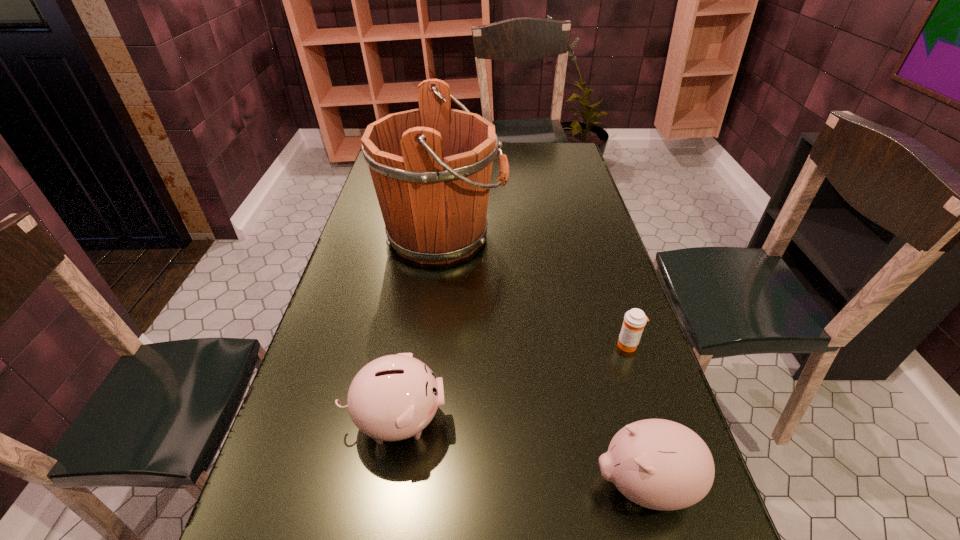
Locate an element on the screen. This screenshot has height=540, width=960. vacant area that lies between the tallest object and the left piggy bank is located at coordinates (420, 328).

At what (x,y) coordinates should I click in order to perform the action: click on free space between the shortest object and the bucket. Please return your answer as a coordinate pair (x, y). The width and height of the screenshot is (960, 540). Looking at the image, I should click on (536, 290).

You are a GUI agent. You are given a task and a screenshot of the screen. Output one action in this format:
    pyautogui.click(x=<x>, y=<y>)
    Task: Click on the vacant space that is in between the bucket and the right piggy bank
    This screenshot has height=540, width=960.
    Given the screenshot: What is the action you would take?
    pyautogui.click(x=543, y=360)

This screenshot has width=960, height=540. In order to click on empty space between the left piggy bank and the right piggy bank in this screenshot , I will do (x=520, y=453).

The height and width of the screenshot is (540, 960). I want to click on free space between the left piggy bank and the bucket, so click(420, 328).

Locate an element on the screen. The width and height of the screenshot is (960, 540). vacant area between the farthest object and the right piggy bank is located at coordinates (543, 360).

The height and width of the screenshot is (540, 960). In order to click on unoccupied area between the farthest object and the right piggy bank in this screenshot , I will do `click(543, 360)`.

Find the location of a particular element. Image resolution: width=960 pixels, height=540 pixels. free spot between the bucket and the left piggy bank is located at coordinates (420, 328).

Locate an element on the screen. free point between the medicine and the tallest object is located at coordinates (536, 290).

Identify which object is the third nearest to the farthest object. Please provide its 2D coordinates. Your answer should be formatted as a tuple, i.e. [(x, y)], where the tuple contains the x and y coordinates of a point satisfying the conditions above.

[(659, 464)]